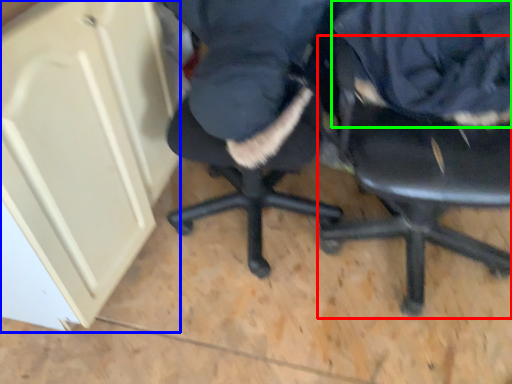
Question: Which object is the closest to the chair (highlighted by a red box)? Choose among these: cabinetry (highlighted by a blue box) or clothing (highlighted by a green box).

Choices:
 (A) cabinetry
 (B) clothing

Answer: (B)